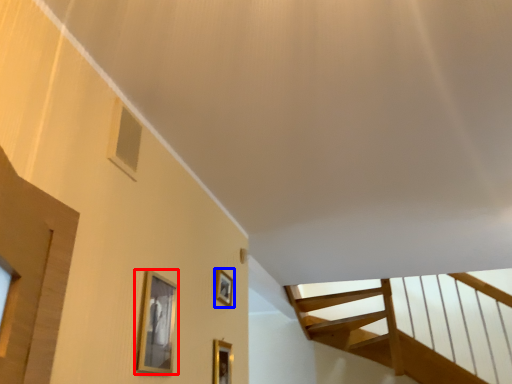
Question: Which object appears farthest to the camera in this image, picture frame (highlighted by a red box) or picture frame (highlighted by a blue box)?

Choices:
 (A) picture frame
 (B) picture frame

Answer: (B)